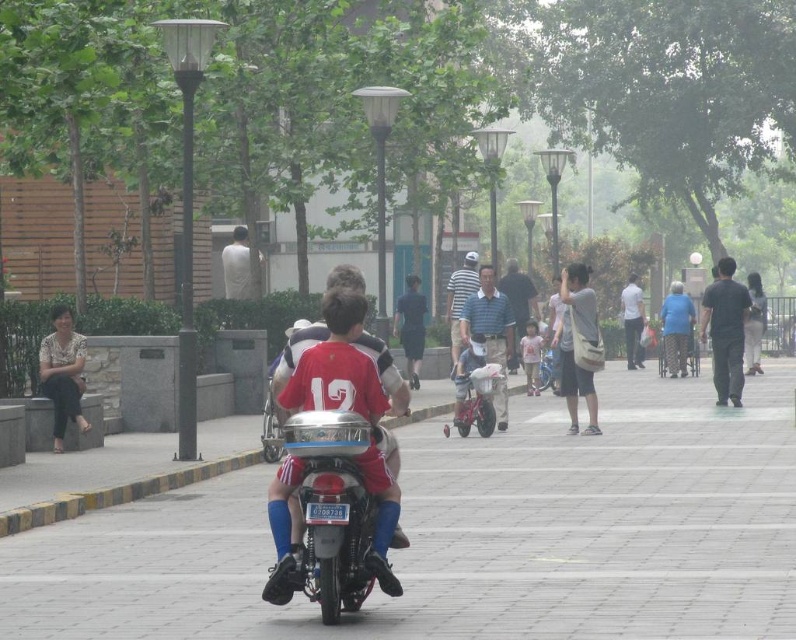
Consider the image. You are standing at the point with coordinates point (419, 307) and want to walk towards the point (572, 369). Which direction should you face to move towards your destination?

You should face forward because point (572, 369) is in front of point (419, 307).

You are a delivery person who needs to deliver a package to the matte gray bag at center and the dark blue fabric shirt at center. Which object is located to the right of the other?

The matte gray bag at center is positioned on the right side of dark blue fabric shirt at center, so the matte gray bag at center is to the right of the dark blue fabric shirt at center.

You are a delivery robot navigating an urban park. Your current position is at point (471, 536). You need to deliver a package to the smooth concrete pavement at center. Is your current position already on the smooth concrete pavement at center?

Yes, your current position at point (471, 536) is exactly where the smooth concrete pavement at center is located, so you are already on it.